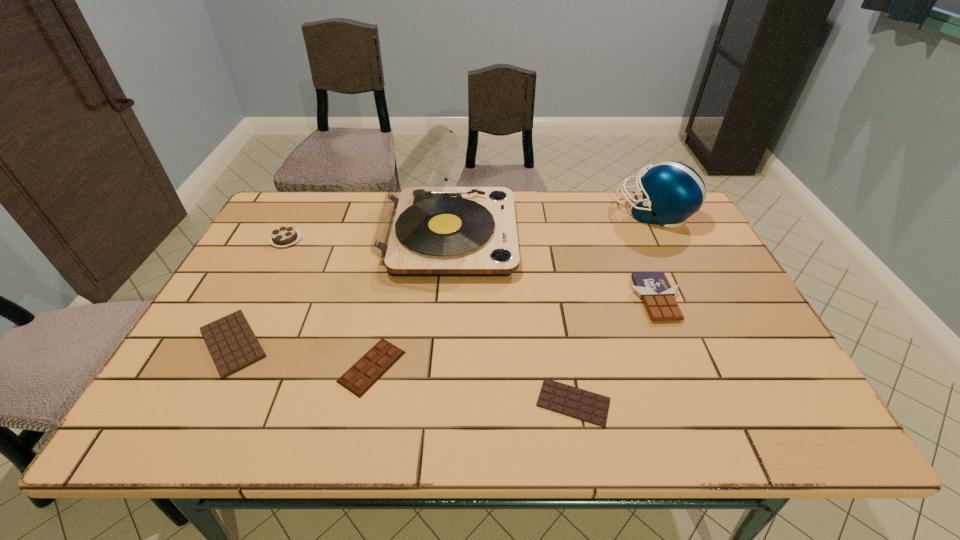
Where is `record player`? record player is located at coordinates (424, 229).

You are a GUI agent. You are given a task and a screenshot of the screen. Output one action in this format:
    pyautogui.click(x=<x>, y=<y>)
    Task: Click on the sixth shortest object
    The image size is (960, 540).
    Given the screenshot: What is the action you would take?
    pyautogui.click(x=672, y=191)

I want to click on chocolate cake, so click(283, 236).

I want to click on the tallest chocolate bar, so click(x=654, y=288).

Identify the location of the third shortest object. (382, 356).

The image size is (960, 540). I want to click on the third shortest chocolate bar, so click(x=382, y=356).

Identify the location of the third tallest chocolate bar. This screenshot has width=960, height=540. (233, 345).

This screenshot has height=540, width=960. I want to click on the leftmost chocolate bar, so click(233, 345).

Where is `the third object from right to left`? The width and height of the screenshot is (960, 540). the third object from right to left is located at coordinates (574, 402).

Identify the location of the shortest chocolate bar. (574, 402).